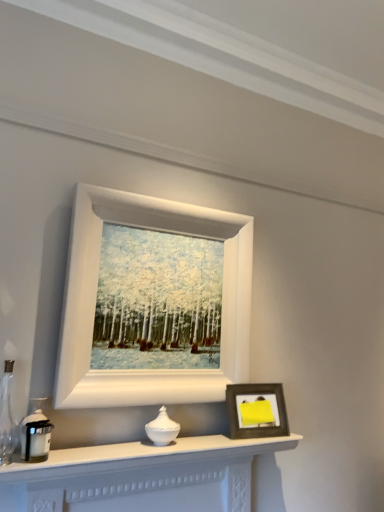
Question: From a real-world perspective, is white glossy vase at center, which is counted as the second candle holder, starting from the left, physically located above or below white matte picture frame at upper center, arranged as the 1th picture frame when viewed from the top?

Choices:
 (A) above
 (B) below

Answer: (B)

Question: Relative to white matte picture frame at upper center, arranged as the 1th picture frame when viewed from the top, is white glossy vase at center, acting as the 1th candle holder starting from the right, in front or behind?

Choices:
 (A) behind
 (B) front

Answer: (A)

Question: Considering the real-world distances, which object is closest to the white matte picture frame at upper center, arranged as the 1th picture frame when viewed from the top?

Choices:
 (A) wooden photo frame at lower right, which is counted as the second picture frame, starting from the top
 (B) white glossy vase at center, the first candle holder when ordered from back to front
 (C) white matte fireplace at lower center
 (D) matte black candle holder at left, the 1th candle holder in the left-to-right sequence

Answer: (A)

Question: Based on their relative distances, which object is nearer to the wooden photo frame at lower right, the first picture frame in the bottom-to-top sequence?

Choices:
 (A) white glossy vase at center, the second candle holder viewed from the front
 (B) white matte fireplace at lower center
 (C) matte black candle holder at left, arranged as the second candle holder when viewed from the back
 (D) white matte picture frame at upper center, placed as the 2th picture frame when sorted from bottom to top

Answer: (B)